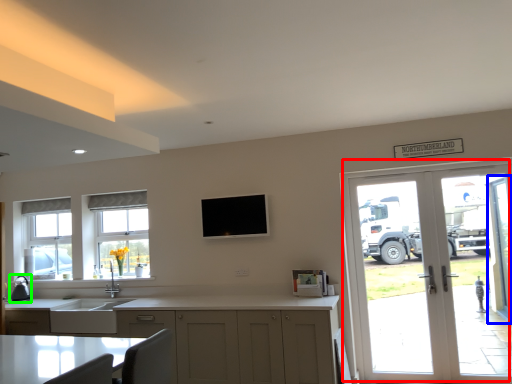
Question: Which object is positioned closest to door (highlighted by a red box)? Select from screen door (highlighted by a blue box) and appliance (highlighted by a green box).

Choices:
 (A) screen door
 (B) appliance

Answer: (A)